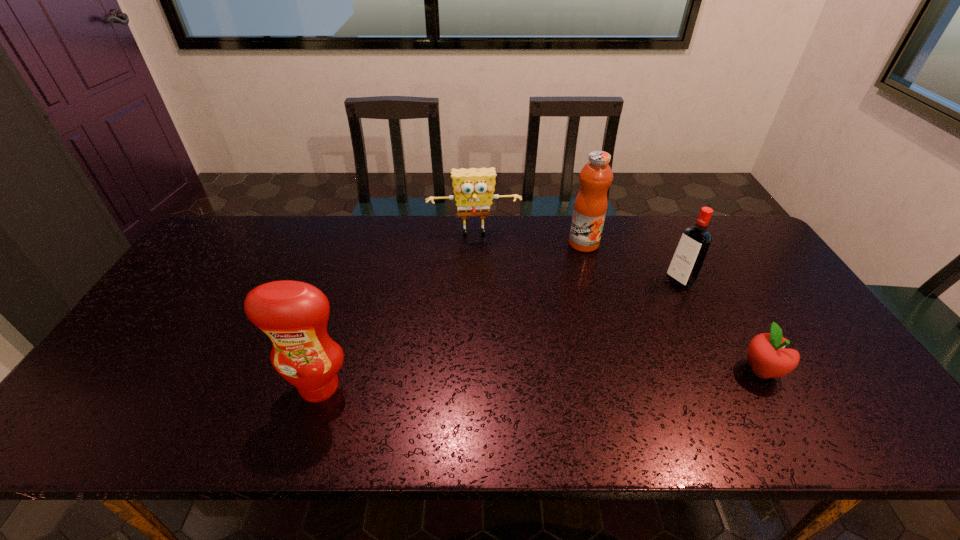
Where is `condiment`? This screenshot has width=960, height=540. condiment is located at coordinates (293, 314).

You are a GUI agent. You are given a task and a screenshot of the screen. Output one action in this format:
    pyautogui.click(x=<x>, y=<y>)
    Task: Click on the apple
    
    Given the screenshot: What is the action you would take?
    pyautogui.click(x=766, y=354)

This screenshot has width=960, height=540. In order to click on the shortest object in this screenshot , I will do `click(766, 354)`.

What are the coordinates of `the third farthest object` in the screenshot? It's located at (690, 253).

Find the location of `vodka`. vodka is located at coordinates (690, 253).

The image size is (960, 540). Identify the location of the third object from left to right. (590, 206).

Find the location of `sponge`. sponge is located at coordinates (473, 188).

The image size is (960, 540). Find the location of `free space located 0.120m on the side where a bite is taken out of the apple`. free space located 0.120m on the side where a bite is taken out of the apple is located at coordinates (831, 370).

Where is `vacant space situated on the front and back of the third nearest object`? The height and width of the screenshot is (540, 960). vacant space situated on the front and back of the third nearest object is located at coordinates (635, 307).

Identify the location of free region located on the front and back of the third nearest object. This screenshot has width=960, height=540. (627, 312).